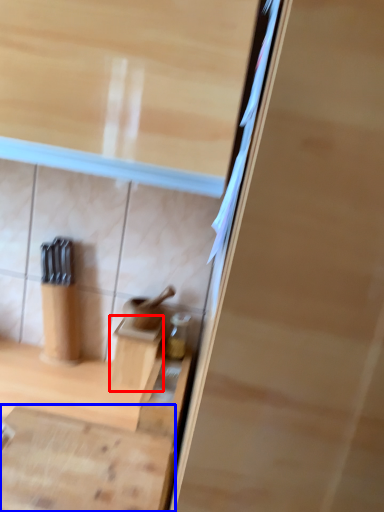
Question: Which object is closer to the camera taking this photo, cabinetry (highlighted by a red box) or cabinetry (highlighted by a blue box)?

Choices:
 (A) cabinetry
 (B) cabinetry

Answer: (B)